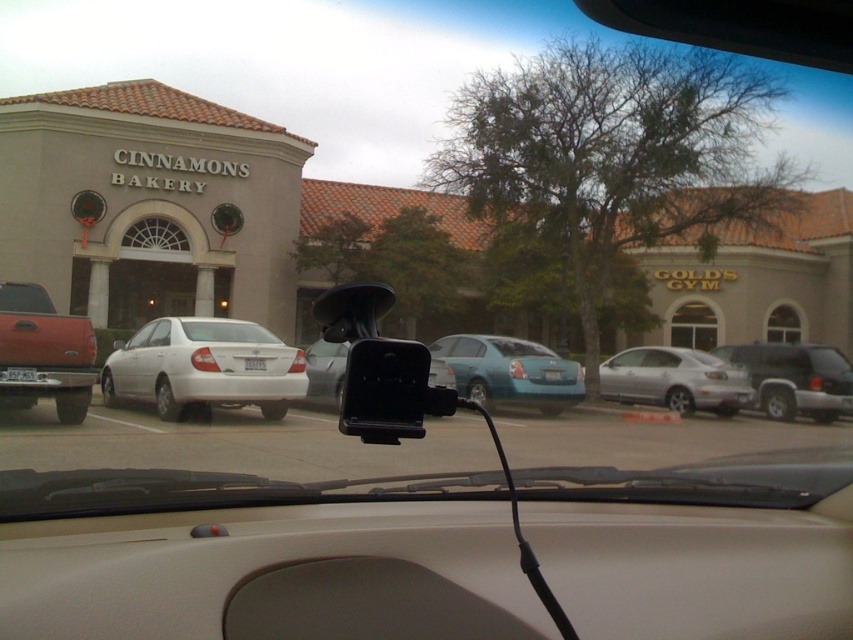
You are a driver who just entered the parking lot and sees the teal matte sedan at center and the silver metallic sedan at center. Which car is blocking your view of the other?

The teal matte sedan at center is positioned over silver metallic sedan at center, so it is blocking the view of the silver metallic sedan at center.

You are inside a car and looking through the windshield. You see two points marked on the windshield. The first point is at coordinates point (381, 356) and the second point is at point (511, 381). Which point is closer to your eyes?

Point (381, 356) is closer to the camera than point (511, 381).

You are driving a car and want to check your blind spot. You have a black plastic view mirror at center and a teal matte sedan at center. Which object should you check to see if there is a vehicle in your blind spot?

You should check the black plastic view mirror at center to see if there is a vehicle in your blind spot because it is positioned to the left of the teal matte sedan at center, which may be blocking your view.